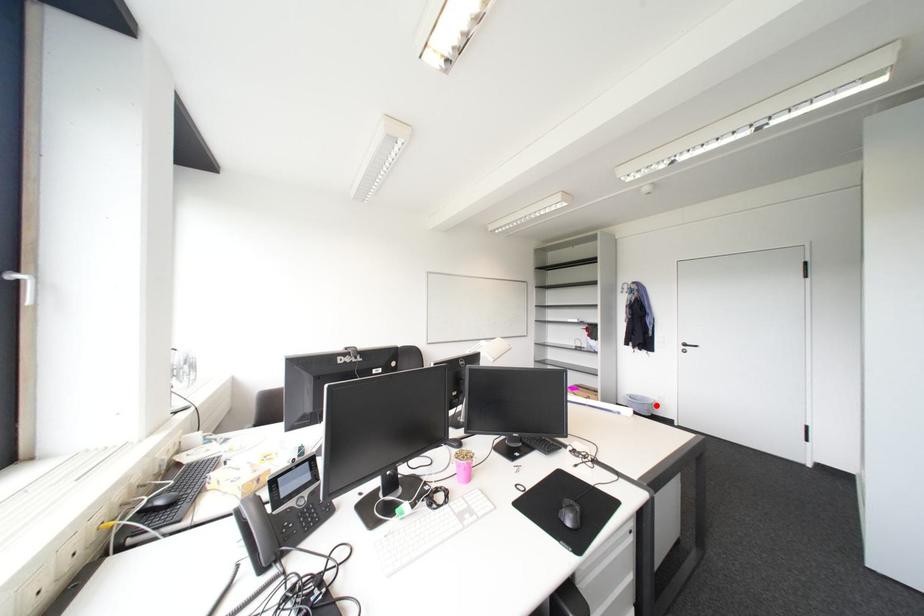
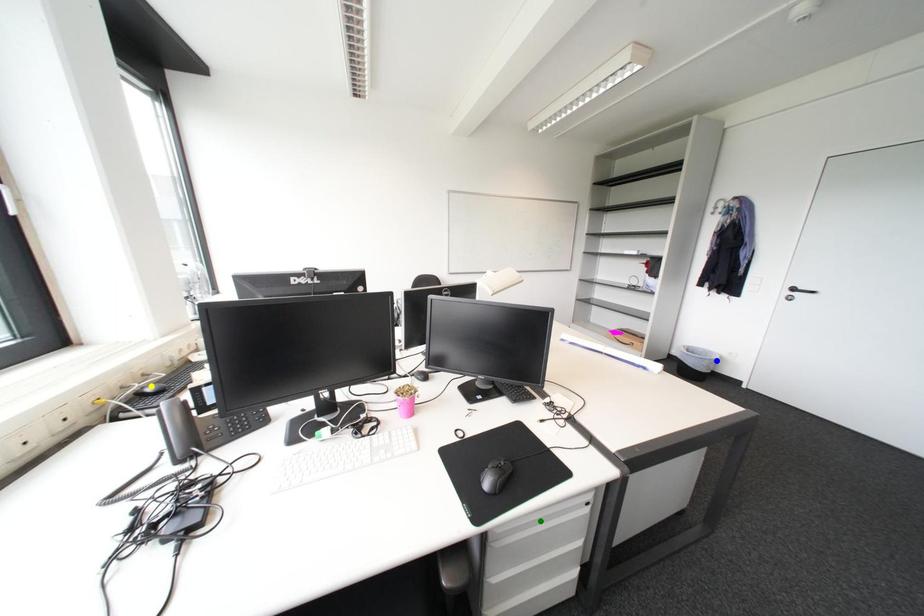
Question: I am providing you with two images of the same scene from different viewpoints. A red point is marked on the first image. You are given multiple points on the second image. Which point in image 2 represents the same 3d spot as the red point in image 1?

Choices:
 (A) yellow point
 (B) green point
 (C) blue point

Answer: (C)